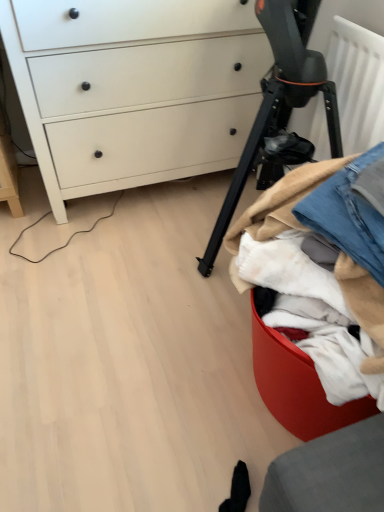
The width and height of the screenshot is (384, 512). I want to click on vacant region in front of white matte chest of drawers at upper left, so click(x=112, y=291).